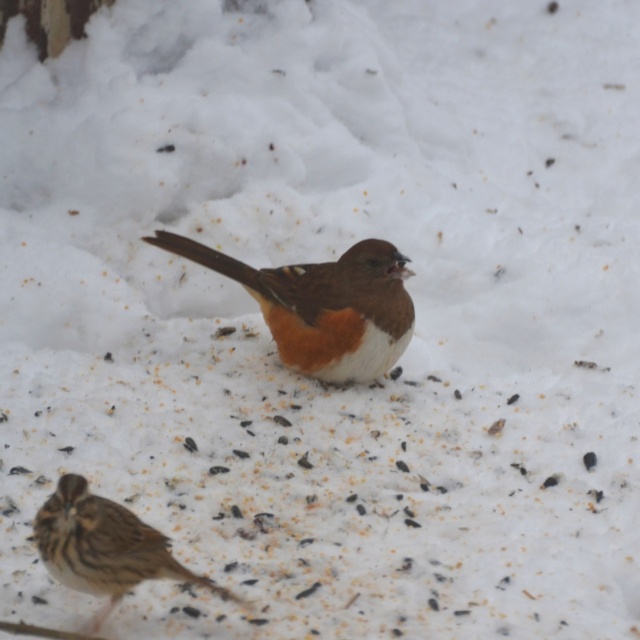
You are a photographer trying to capture the brown feathered sparrow at center. You notice a point marked at coordinates (x=323, y=307). Is this point likely located on the bird?

Yes, the point (x=323, y=307) corresponds to the brown feathered sparrow at center, so it is likely located on the bird.

You are a birdwatcher trying to capture both the brown feathered sparrow at center and the brown speckled sparrow at lower left in a single photo. Your camera has a maximum focus range of 70 centimeters. Can you fit both birds into the frame without moving your position?

The distance between the brown feathered sparrow at center and the brown speckled sparrow at lower left is 74.39 centimeters. Since your camera can only focus within 70 centimeters, you cannot fit both birds into the frame without moving closer or adjusting your position.

You are a photographer trying to capture both birds in a single shot. Since the brown feathered sparrow at center is above the brown speckled sparrow at lower left, which bird should you focus on first to ensure both are in focus?

You should focus on the brown feathered sparrow at center first because it is closer to the camera than the brown speckled sparrow at lower left, ensuring both will be in focus when focusing on the closer subject.